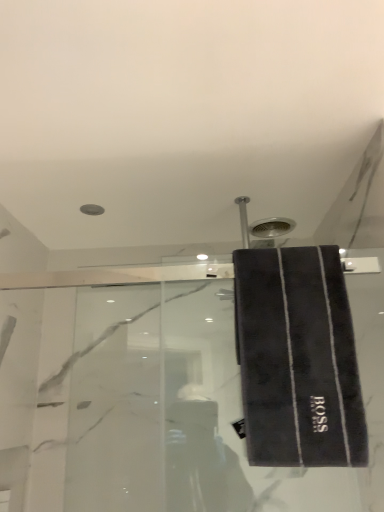
Looking at this image, measure the distance between dark gray plush towel at upper right and camera.

dark gray plush towel at upper right is 32.59 inches away from camera.

The width and height of the screenshot is (384, 512). What do you see at coordinates (298, 359) in the screenshot?
I see `dark gray plush towel at upper right` at bounding box center [298, 359].

I want to click on dark gray plush towel at upper right, so click(x=298, y=359).

Image resolution: width=384 pixels, height=512 pixels. Find the location of `dark gray plush towel at upper right`. dark gray plush towel at upper right is located at coordinates (298, 359).